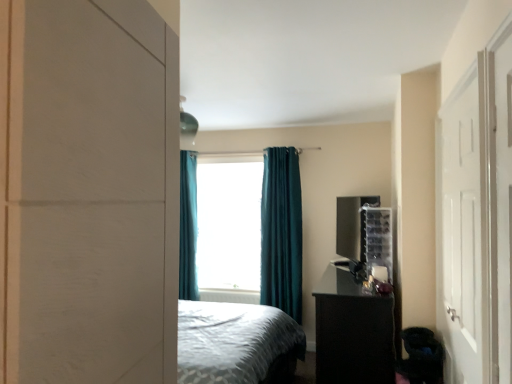
Question: Does teal curtain at center appear on the right side of white matte door at right?

Choices:
 (A) yes
 (B) no

Answer: (B)

Question: Is teal curtain at center touching white matte door at right?

Choices:
 (A) no
 (B) yes

Answer: (A)

Question: Does teal curtain at center lie behind white matte door at right?

Choices:
 (A) yes
 (B) no

Answer: (A)

Question: Is white matte door at right inside teal curtain at center?

Choices:
 (A) yes
 (B) no

Answer: (B)

Question: Can you confirm if teal curtain at center is thinner than white matte door at right?

Choices:
 (A) no
 (B) yes

Answer: (A)

Question: Is point (371, 210) positioned closer to the camera than point (456, 92)?

Choices:
 (A) farther
 (B) closer

Answer: (A)

Question: Considering the positions of clear plastic organizer at right and white matte door at right in the image, is clear plastic organizer at right wider or thinner than white matte door at right?

Choices:
 (A) wide
 (B) thin

Answer: (A)

Question: From the image's perspective, is clear plastic organizer at right located above or below white matte door at right?

Choices:
 (A) below
 (B) above

Answer: (A)

Question: Is clear plastic organizer at right situated inside white matte door at right or outside?

Choices:
 (A) outside
 (B) inside

Answer: (A)

Question: Does point (384, 210) appear closer or farther from the camera than point (219, 294)?

Choices:
 (A) farther
 (B) closer

Answer: (B)

Question: Considering the positions of clear plastic organizer at right and white plastic radiator at center in the image, is clear plastic organizer at right wider or thinner than white plastic radiator at center?

Choices:
 (A) wide
 (B) thin

Answer: (A)

Question: Which is correct: clear plastic organizer at right is inside white plastic radiator at center, or outside of it?

Choices:
 (A) inside
 (B) outside

Answer: (B)

Question: From the image's perspective, is clear plastic organizer at right above or below white plastic radiator at center?

Choices:
 (A) above
 (B) below

Answer: (A)

Question: Is teal fabric curtain at center, placed as the first curtain when sorted from front to back, wider or thinner than white plastic radiator at center?

Choices:
 (A) wide
 (B) thin

Answer: (A)

Question: Is teal fabric curtain at center, arranged as the 2th curtain when viewed from the left, in front of or behind white plastic radiator at center in the image?

Choices:
 (A) front
 (B) behind

Answer: (A)